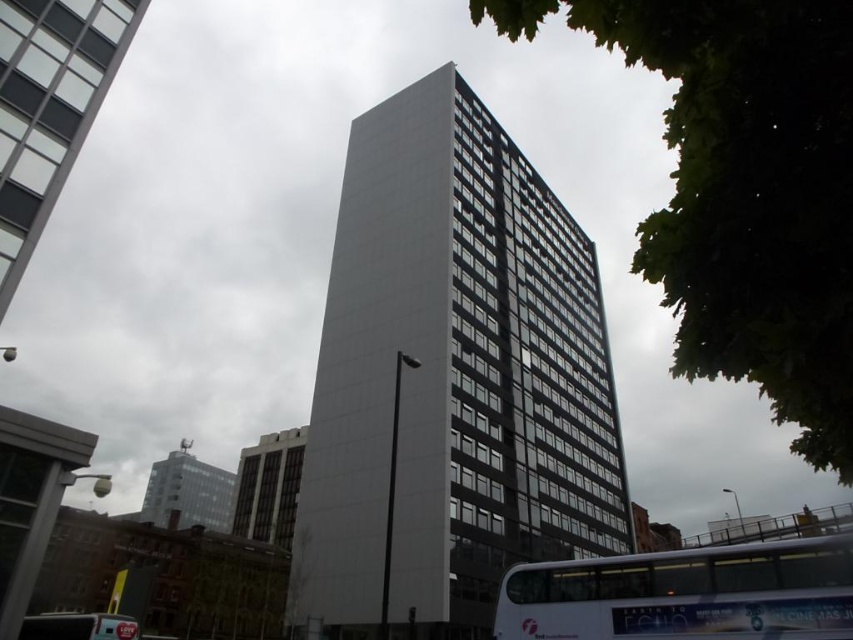
You are standing on the street looking at the modern building. There are two points marked on the bus, one at coordinate point (x=804, y=550) and another at point (x=109, y=636). Which point is closer to you?

The point at (x=804, y=550) is closer to you than the point at (x=109, y=636).

You are a city planner analyzing the urban layout. Given the white glass building at upper left and the white plastic bus at lower left, which object occupies a narrower width in the image?

The white glass building at upper left is thinner than the white plastic bus at lower left, so it occupies a narrower width in the image.